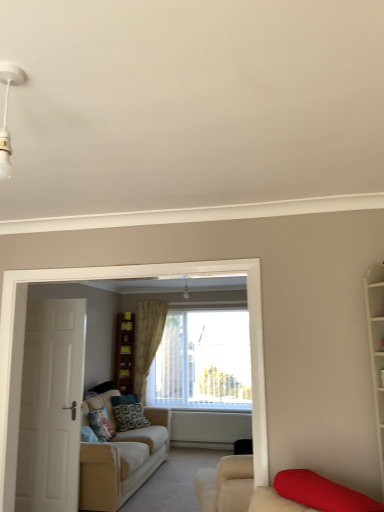
Question: Does white plastic light fixture at upper left have a lesser height compared to beige fabric couch at left?

Choices:
 (A) no
 (B) yes

Answer: (B)

Question: Does white plastic light fixture at upper left have a greater width compared to beige fabric couch at left?

Choices:
 (A) yes
 (B) no

Answer: (B)

Question: Is white plastic light fixture at upper left far away from beige fabric couch at left?

Choices:
 (A) yes
 (B) no

Answer: (A)

Question: Considering the relative positions of white plastic light fixture at upper left and beige fabric couch at left in the image provided, is white plastic light fixture at upper left in front of beige fabric couch at left?

Choices:
 (A) yes
 (B) no

Answer: (A)

Question: Is white plastic light fixture at upper left further to the viewer compared to beige fabric couch at left?

Choices:
 (A) yes
 (B) no

Answer: (B)

Question: From a real-world perspective, is white plastic light fixture at upper left on beige fabric couch at left?

Choices:
 (A) no
 (B) yes

Answer: (B)

Question: Is white wooden door at left positioned before wooden bookshelf at center, placed as the first shelf when sorted from bottom to top?

Choices:
 (A) no
 (B) yes

Answer: (B)

Question: Does white wooden door at left contain wooden bookshelf at center, the second shelf in the top-to-bottom sequence?

Choices:
 (A) yes
 (B) no

Answer: (B)

Question: Is white wooden door at left beside wooden bookshelf at center, the second shelf in the top-to-bottom sequence?

Choices:
 (A) no
 (B) yes

Answer: (A)

Question: Is white wooden door at left turned away from wooden bookshelf at center, the second shelf in the top-to-bottom sequence?

Choices:
 (A) yes
 (B) no

Answer: (A)

Question: Are white wooden door at left and wooden bookshelf at center, the second shelf in the top-to-bottom sequence, far apart?

Choices:
 (A) yes
 (B) no

Answer: (A)

Question: Is white wooden door at left completely or partially outside of wooden bookshelf at center, the second shelf in the top-to-bottom sequence?

Choices:
 (A) yes
 (B) no

Answer: (A)

Question: Does patterned fabric pillow at center, acting as the 1th pillow starting from the front, have a smaller size compared to brown wooden bookshelf at center?

Choices:
 (A) no
 (B) yes

Answer: (B)